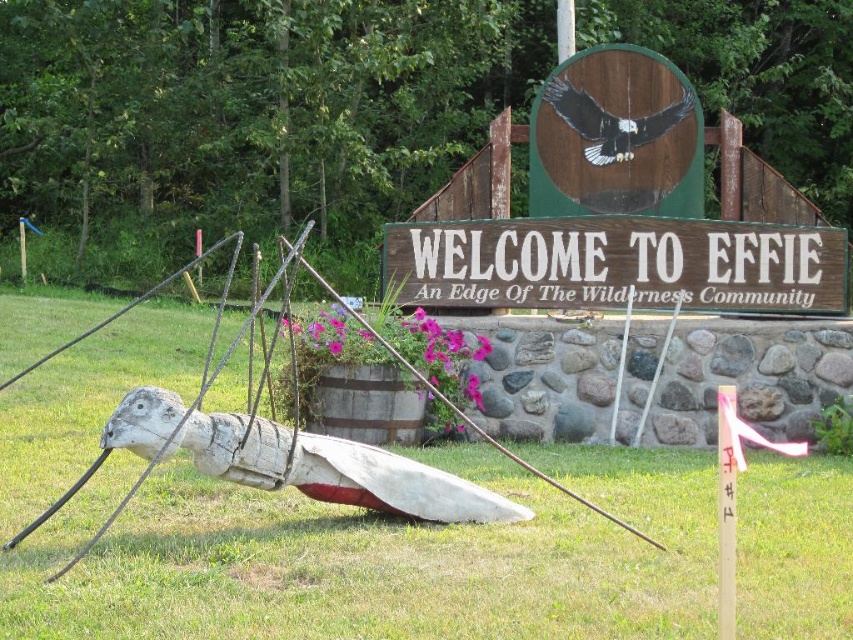
Which is more to the left, green grass at lower center or wooden sign at center?

From the viewer's perspective, green grass at lower center appears more on the left side.

Is green grass at lower center thinner than wooden sign at center?

In fact, green grass at lower center might be wider than wooden sign at center.

This screenshot has width=853, height=640. What do you see at coordinates (380, 556) in the screenshot?
I see `green grass at lower center` at bounding box center [380, 556].

This screenshot has height=640, width=853. Identify the location of green grass at lower center. (380, 556).